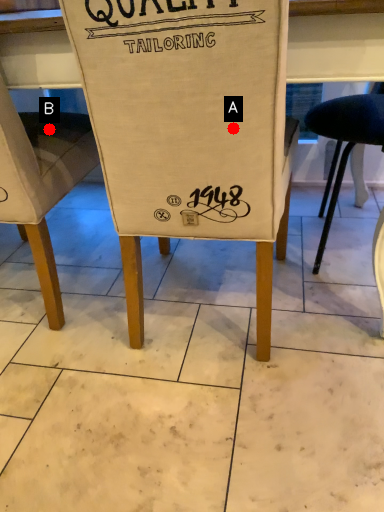
Question: Two points are circled on the image, labeled by A and B beside each circle. Which point is closer to the camera?

Choices:
 (A) A is closer
 (B) B is closer

Answer: (A)